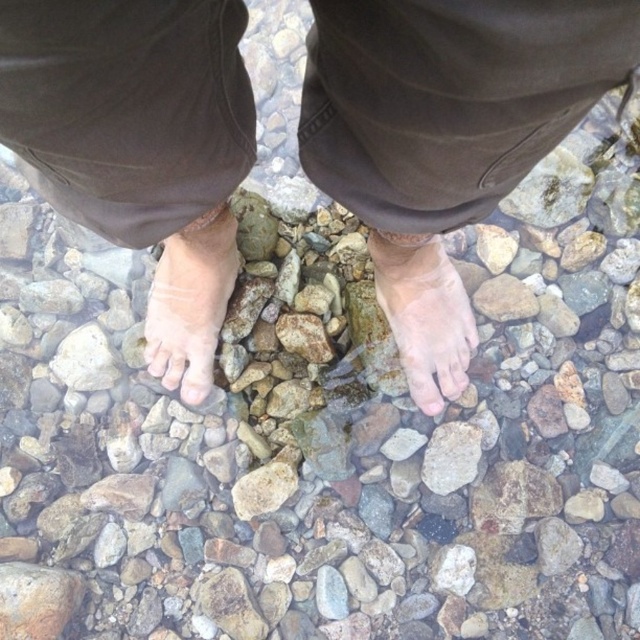
Between pale skin foot at center and pale skin at center, which one has less height?

pale skin foot at center is shorter.

Is pale skin foot at center bigger than pale skin at center?

No.

Between point (400, 236) and point (189, 230), which one is positioned in front?

Point (400, 236) is more forward.

Where is `pale skin foot at center`? The height and width of the screenshot is (640, 640). pale skin foot at center is located at coordinates (424, 314).

Is skinny bare feet at center below pale skin foot at center?

No.

Is the position of skinny bare feet at center less distant than that of pale skin foot at center?

That is True.

Who is more forward, [490,0] or [436,401]?

Positioned in front is point [490,0].

The height and width of the screenshot is (640, 640). I want to click on skinny bare feet at center, so point(445,136).

Between skinny bare feet at center and pale skin at center, which one has less height?

pale skin at center is shorter.

Can you confirm if skinny bare feet at center is positioned above pale skin at center?

Indeed, skinny bare feet at center is positioned over pale skin at center.

Who is more distant from viewer, (566, 118) or (221, 228)?

The point (221, 228) is more distant.

You are a GUI agent. You are given a task and a screenshot of the screen. Output one action in this format:
    pyautogui.click(x=<x>, y=<y>)
    Task: Click on the skinny bare feet at center
    The width and height of the screenshot is (640, 640).
    Given the screenshot: What is the action you would take?
    pyautogui.click(x=445, y=136)